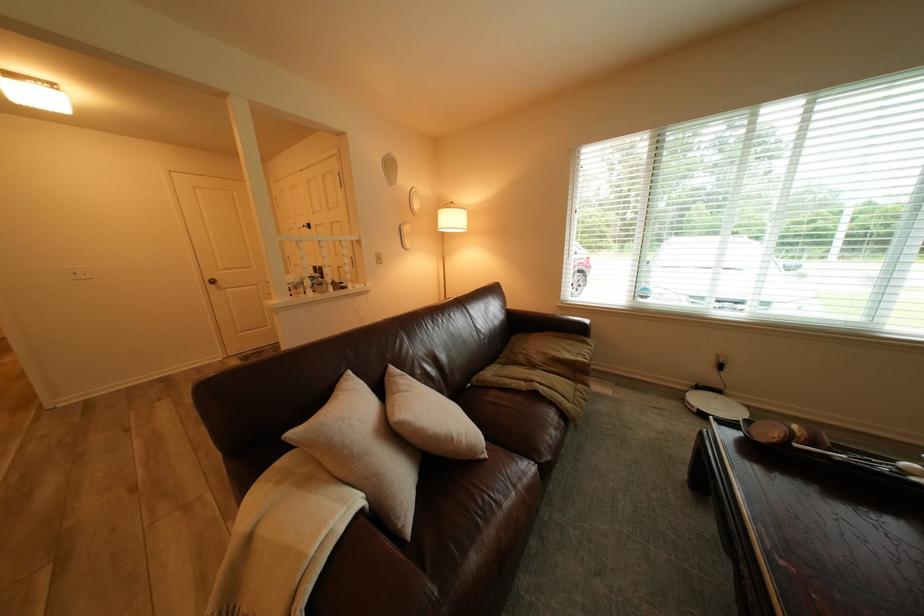
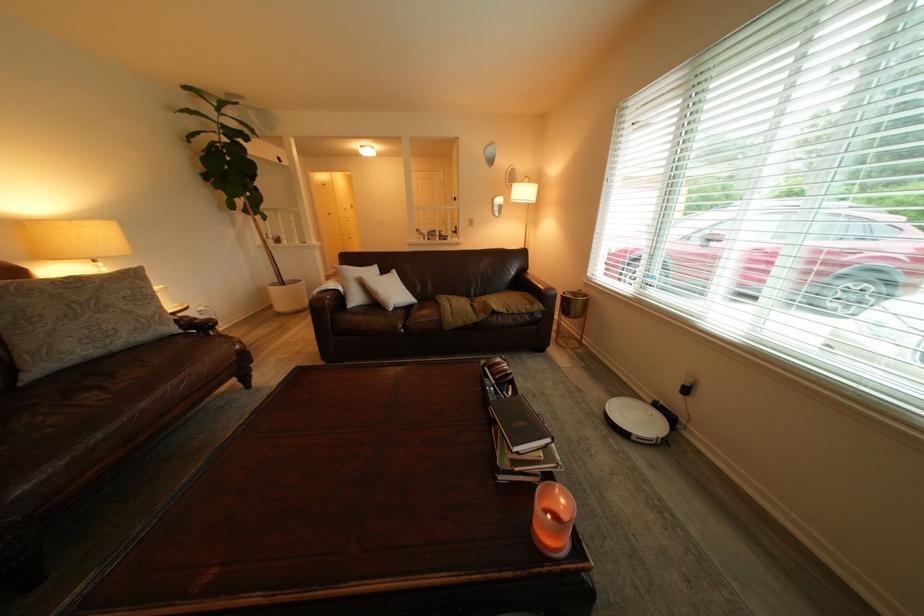
Find the pixel in the second image that matches [603,347] in the first image.

(546, 309)